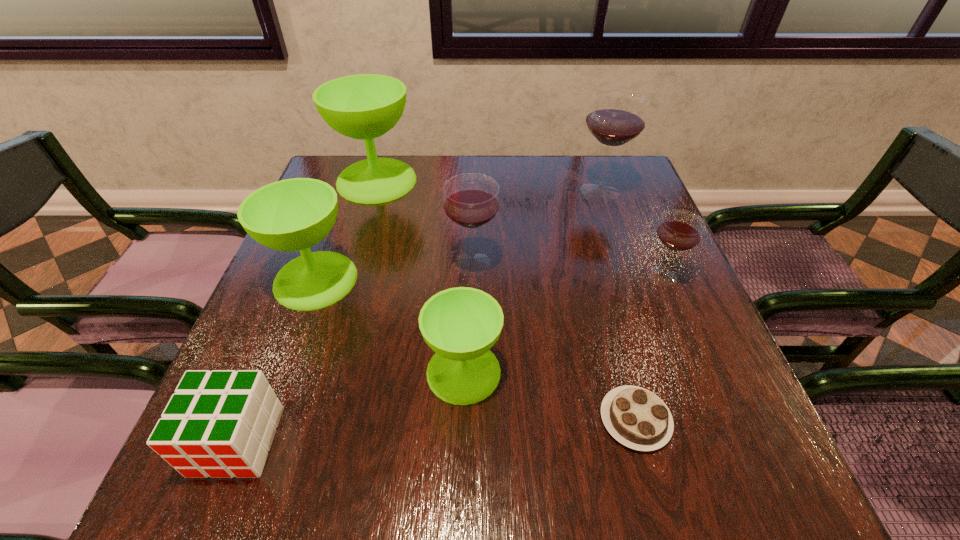
Locate an element on the screen. The width and height of the screenshot is (960, 540). free space located on the back of the biggest red wineglass is located at coordinates (591, 168).

Locate an element on the screen. This screenshot has height=540, width=960. free space located on the front of the biggest green wineglass is located at coordinates (346, 285).

Identify the location of free region located on the right of the second biggest red wineglass. click(x=667, y=263).

This screenshot has height=540, width=960. What are the coordinates of `free spot located 0.070m on the front of the second nearest green wineglass` in the screenshot? It's located at (294, 338).

Locate an element on the screen. The width and height of the screenshot is (960, 540). vacant region located on the left of the smallest red wineglass is located at coordinates (531, 276).

The height and width of the screenshot is (540, 960). Find the location of `vacant space located on the right of the nearest green wineglass`. vacant space located on the right of the nearest green wineglass is located at coordinates (632, 372).

Find the location of a particular element. The image size is (960, 540). free region located 0.360m on the left of the shortest object is located at coordinates (386, 420).

Where is `cube that is at the near edge`? This screenshot has height=540, width=960. cube that is at the near edge is located at coordinates (221, 423).

Find the location of `chocolate cake present at the near edge`. chocolate cake present at the near edge is located at coordinates click(637, 418).

At what (x,y) coordinates should I click in order to perform the action: click on cube at the left edge. Please return your answer as a coordinate pair (x, y). Looking at the image, I should click on (221, 423).